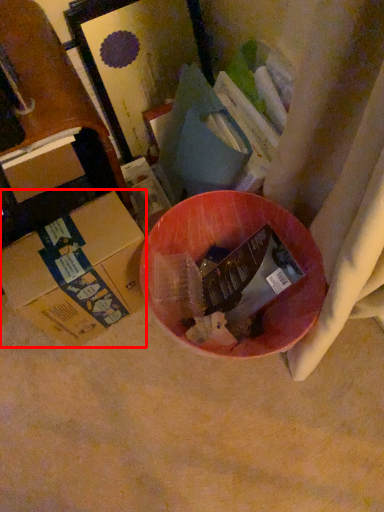
Question: Observing the image, what is the correct spatial positioning of box (annotated by the red box) in reference to box?

Choices:
 (A) right
 (B) left

Answer: (A)